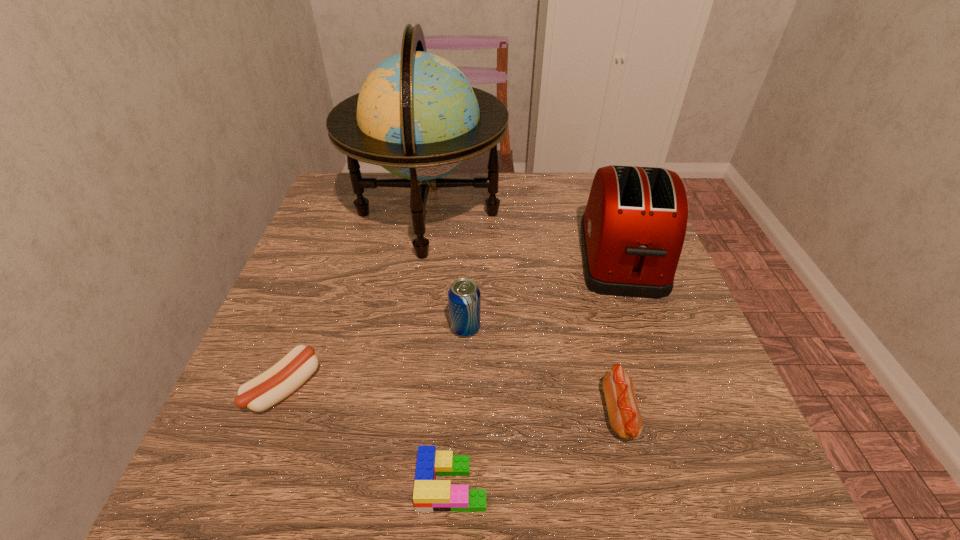
Image resolution: width=960 pixels, height=540 pixels. I want to click on vacant space that's between the Lego and the globe, so click(441, 349).

Locate an element on the screen. The image size is (960, 540). free area in between the nearest object and the left sausage is located at coordinates (369, 436).

Locate an element on the screen. The height and width of the screenshot is (540, 960). vacant point located between the fourth nearest object and the nearest object is located at coordinates (459, 406).

Locate an element on the screen. free space between the globe and the right sausage is located at coordinates (524, 313).

The image size is (960, 540). What are the coordinates of `empty space between the nearest object and the globe` in the screenshot? It's located at (441, 349).

I want to click on free space between the left sausage and the third tallest object, so click(375, 357).

This screenshot has width=960, height=540. Find the location of `object that is the closest to the right sausage`. object that is the closest to the right sausage is located at coordinates (632, 231).

Locate which object ranks fifth in proximity to the globe. Please provide its 2D coordinates. Your answer should be formatted as a tuple, i.e. [(x, y)], where the tuple contains the x and y coordinates of a point satisfying the conditions above.

[(430, 495)]

This screenshot has width=960, height=540. I want to click on free spot that satisfies the following two spatial constraints: 1. on the surface of the globe; 2. on the right side of the nearest object, so click(388, 484).

Identify the location of vacant region that satisfies the following two spatial constraints: 1. on the surface of the tallest object; 2. on the left side of the right sausage. The image size is (960, 540). (398, 413).